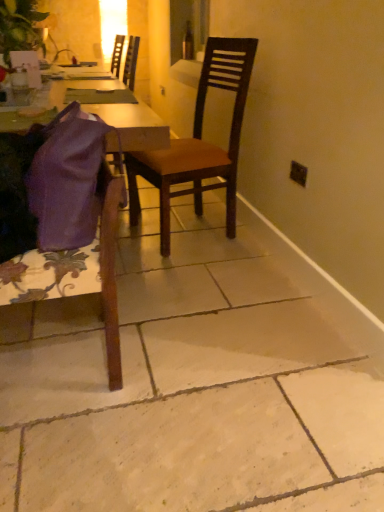
Identify the location of free spot below purple fabric bag at lower left, the 1th chair from the front (from a real-world perspective). The width and height of the screenshot is (384, 512). (56, 361).